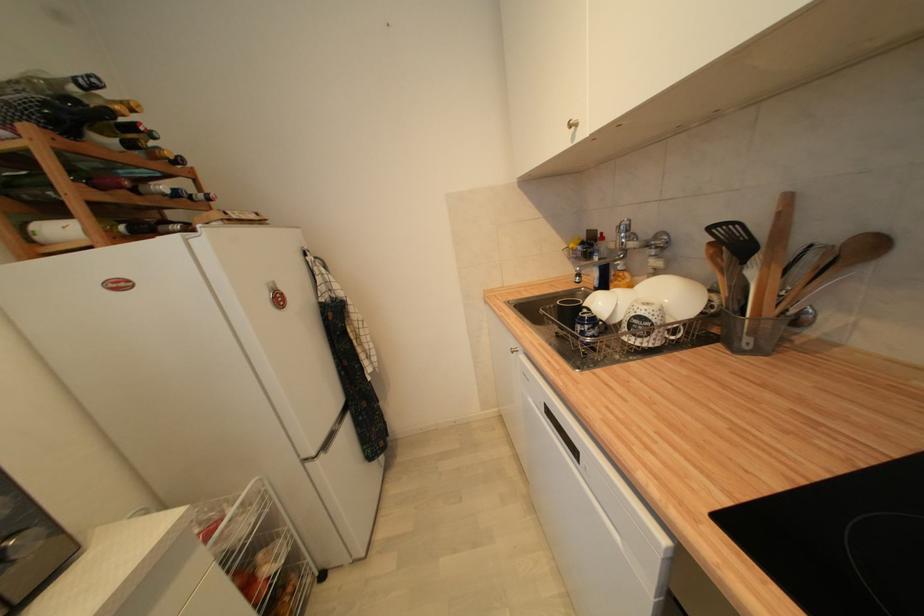
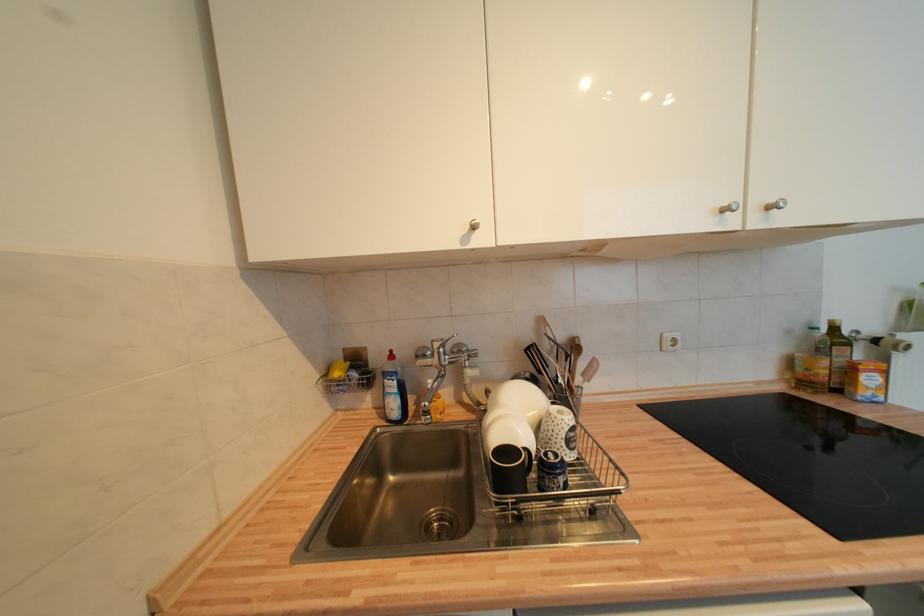
Locate, in the second image, the point that corresponds to the point at 577,246 in the first image.

(343, 376)